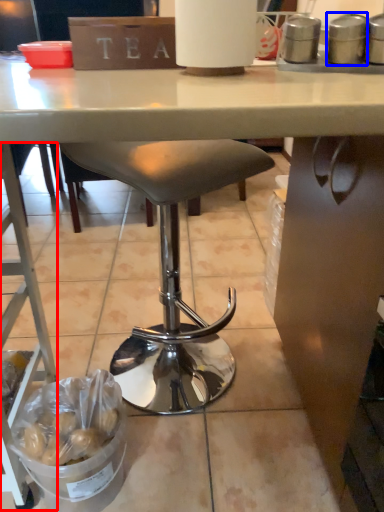
Question: Which point is closer to the camera, ladder (highlighted by a red box) or appliance (highlighted by a blue box)?

Choices:
 (A) ladder
 (B) appliance

Answer: (A)